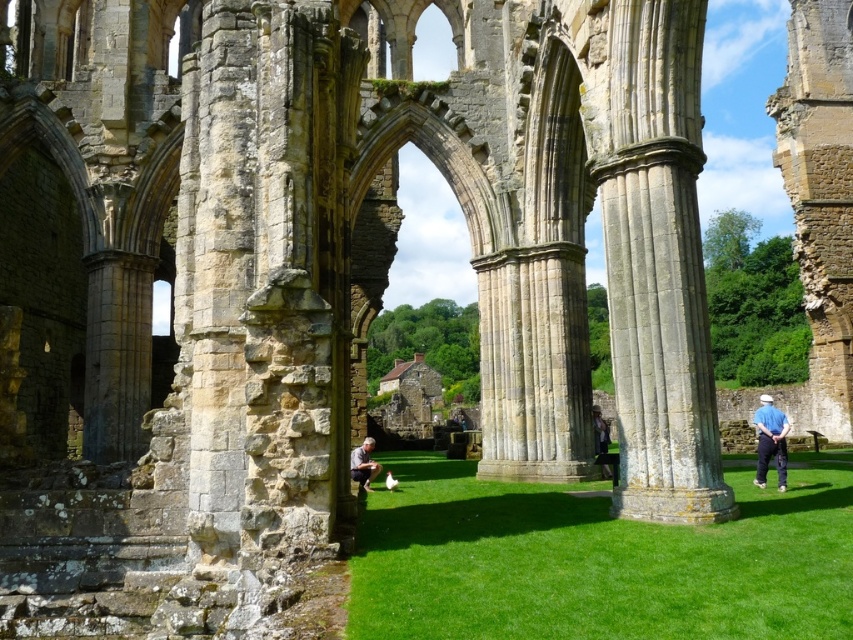
Question: Which of these objects is positioned farthest from the stone column at center?

Choices:
 (A) blue fabric pants at lower right
 (B) green grass at center

Answer: (A)

Question: Is matte gray shirt at center wider than dark blue jeans at center?

Choices:
 (A) no
 (B) yes

Answer: (A)

Question: Which of the following is the farthest from the observer?

Choices:
 (A) (601, 432)
 (B) (637, 333)
 (C) (831, 602)

Answer: (A)

Question: Which of the following is the farthest from the observer?

Choices:
 (A) (364, 474)
 (B) (602, 435)

Answer: (B)

Question: Is matte gray shirt at center smaller than dark blue jeans at center?

Choices:
 (A) yes
 (B) no

Answer: (A)

Question: Does matte gray shirt at center appear on the right side of dark blue jeans at center?

Choices:
 (A) no
 (B) yes

Answer: (A)